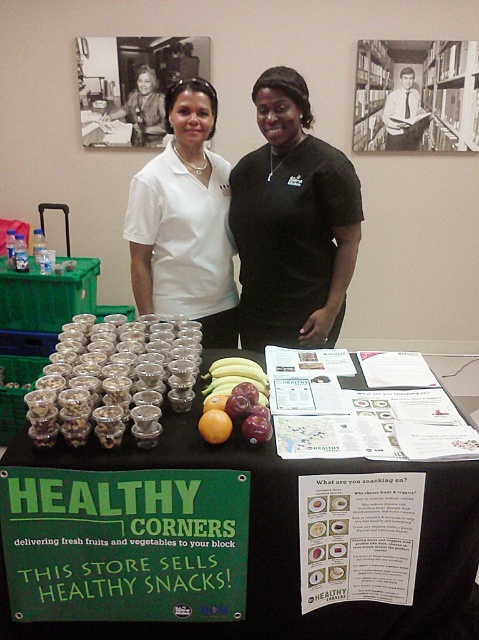
Is black matte shirt at center below translucent glass cups at center?

No.

Does point (286, 195) come farther from viewer compared to point (110, 340)?

Yes, it is.

Locate an element on the screen. This screenshot has height=640, width=479. black matte shirt at center is located at coordinates (293, 221).

Measure the distance between metallic silver bookshelf at upper right and yellow matte apple at center.

metallic silver bookshelf at upper right and yellow matte apple at center are 2.74 meters apart.

Can you confirm if metallic silver bookshelf at upper right is positioned to the right of yellow matte apple at center?

Yes, metallic silver bookshelf at upper right is to the right of yellow matte apple at center.

Locate an element on the screen. The width and height of the screenshot is (479, 640). metallic silver bookshelf at upper right is located at coordinates (415, 96).

Who is more forward, (123, 458) or (225, 426)?

Point (123, 458) is in front.

Does black fabric table at center appear under yellow matte apple at center?

Indeed, black fabric table at center is positioned under yellow matte apple at center.

Is point (360, 637) positioned before point (200, 420)?

No, (360, 637) is behind (200, 420).

Locate an element on the screen. This screenshot has height=640, width=479. black fabric table at center is located at coordinates (285, 545).